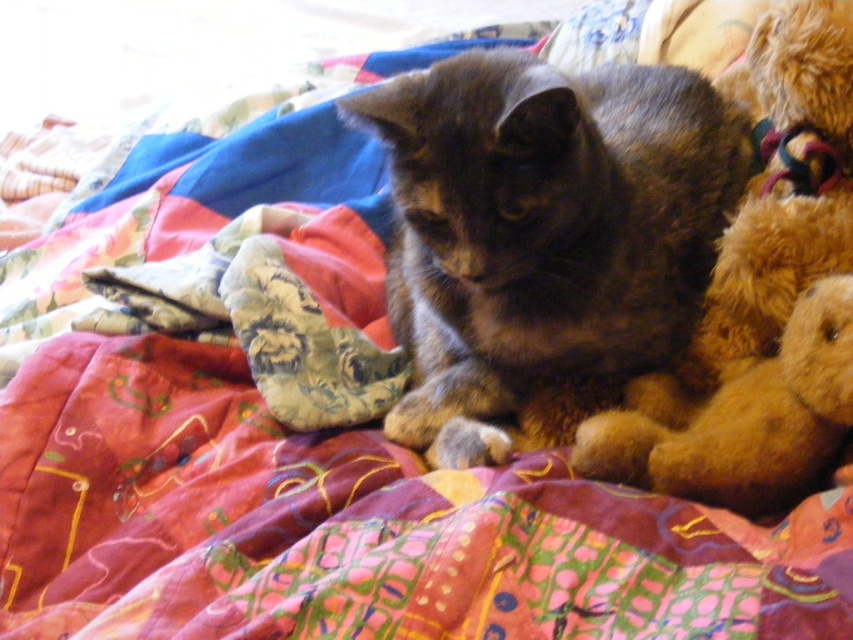
Question: Which object is closer to the camera taking this photo?

Choices:
 (A) fluffy brown teddy bear at right
 (B) fuzzy brown teddy bear at right
 (C) dark brown fur cat at center

Answer: (C)

Question: Estimate the real-world distances between objects in this image. Which object is farther from the fluffy brown teddy bear at right?

Choices:
 (A) dark brown fur cat at center
 (B) fuzzy brown teddy bear at right

Answer: (A)

Question: From the image, what is the correct spatial relationship of dark brown fur cat at center in relation to fluffy brown teddy bear at right?

Choices:
 (A) below
 (B) above

Answer: (B)

Question: Is dark brown fur cat at center wider than fuzzy brown teddy bear at right?

Choices:
 (A) no
 (B) yes

Answer: (B)

Question: Which point is farther to the camera?

Choices:
 (A) (846, 262)
 (B) (753, 516)
 (C) (566, 205)

Answer: (A)

Question: Is fluffy brown teddy bear at right wider than fuzzy brown teddy bear at right?

Choices:
 (A) yes
 (B) no

Answer: (A)